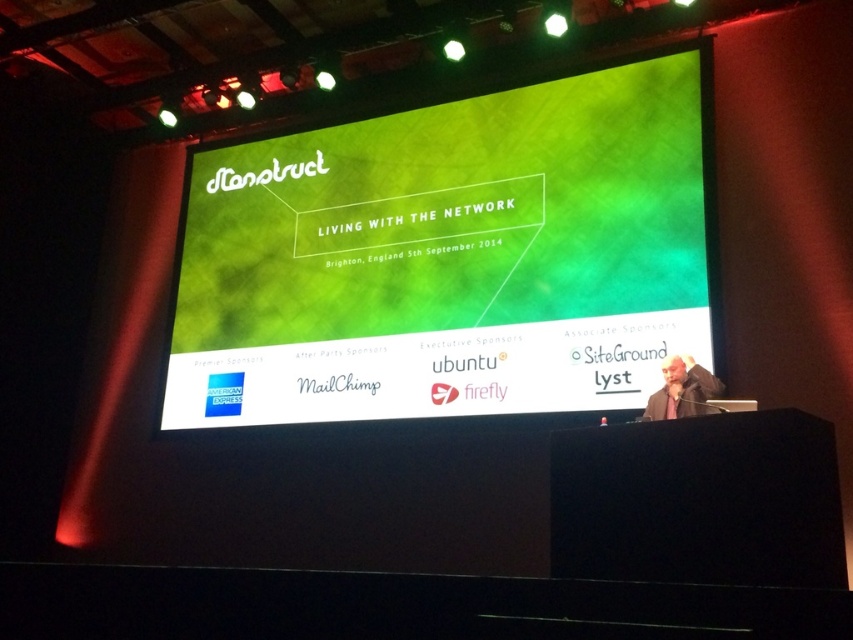
Question: Which point appears farthest from the camera in this image?

Choices:
 (A) (677, 406)
 (B) (334, 326)

Answer: (B)

Question: Can you confirm if green matte projection screen at center is positioned below dark gray jacket at lower right?

Choices:
 (A) yes
 (B) no

Answer: (B)

Question: Does green matte projection screen at center appear on the left side of dark gray jacket at lower right?

Choices:
 (A) no
 (B) yes

Answer: (B)

Question: Is the position of green matte projection screen at center more distant than that of dark gray jacket at lower right?

Choices:
 (A) yes
 (B) no

Answer: (A)

Question: Among these points, which one is farthest from the camera?

Choices:
 (A) (662, 392)
 (B) (537, 326)

Answer: (B)